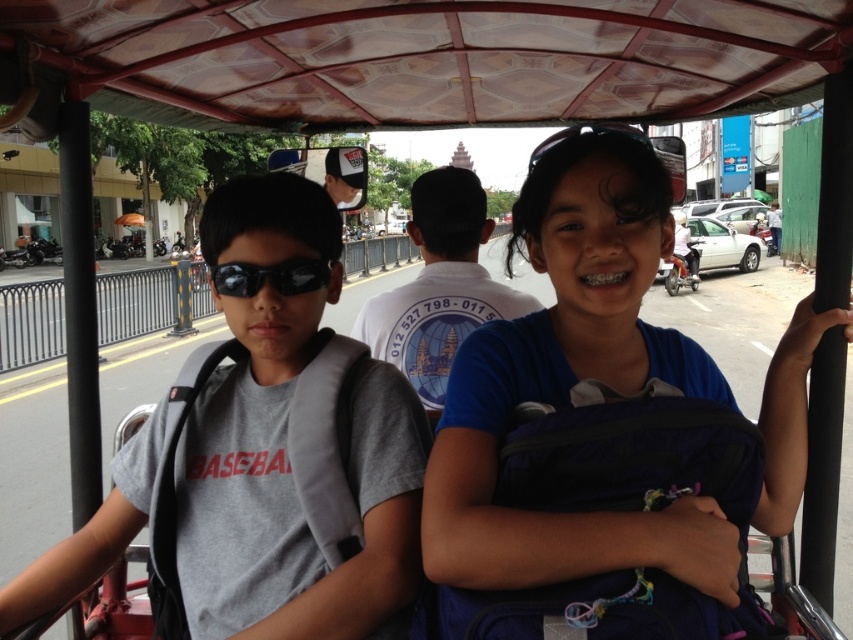
Measure the distance between gray fabric backpack at left and black matte sunglasses at center.

The distance of gray fabric backpack at left from black matte sunglasses at center is 32.90 inches.

Is gray fabric backpack at left positioned in front of black matte sunglasses at center?

Yes, gray fabric backpack at left is in front of black matte sunglasses at center.

Describe the element at coordinates (287, 452) in the screenshot. The height and width of the screenshot is (640, 853). I see `gray fabric backpack at left` at that location.

The height and width of the screenshot is (640, 853). What are the coordinates of `gray fabric backpack at left` in the screenshot? It's located at (287, 452).

Which is more to the left, blue fabric backpack at center or black matte sunglasses at center?

blue fabric backpack at center is more to the left.

Is point (555, 186) less distant than point (585, 132)?

That is True.

This screenshot has height=640, width=853. In order to click on blue fabric backpack at center in this screenshot , I will do `click(572, 387)`.

The height and width of the screenshot is (640, 853). What do you see at coordinates (270, 276) in the screenshot? I see `black reflective sunglasses at left` at bounding box center [270, 276].

Between point (289, 260) and point (540, 147), which one is positioned behind?

Point (540, 147)

Identify the location of black reflective sunglasses at left. Image resolution: width=853 pixels, height=640 pixels. (270, 276).